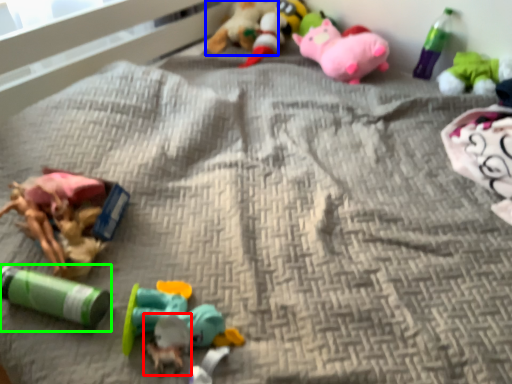
Question: Considering the real-world distances, which object is closest to toy (highlighted by a red box)? toy (highlighted by a blue box) or toy (highlighted by a green box).

Choices:
 (A) toy
 (B) toy

Answer: (B)